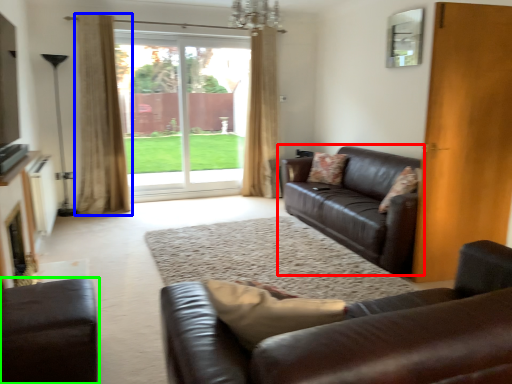
Question: Considering the real-world distances, which object is farthest from studio couch (highlighted by a red box)? curtain (highlighted by a blue box) or studio couch (highlighted by a green box)?

Choices:
 (A) curtain
 (B) studio couch

Answer: (A)